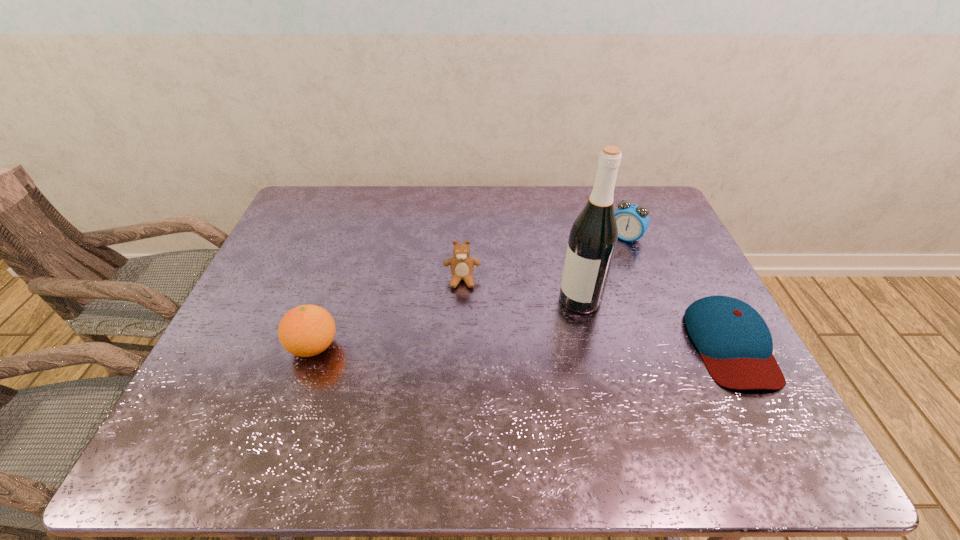
At what (x,y) coordinates should I click in order to perform the action: click on vacant area located on the face of the alarm clock. Please return your answer as a coordinate pair (x, y). This screenshot has width=960, height=540. Looking at the image, I should click on (559, 326).

This screenshot has height=540, width=960. I want to click on vacant area situated 0.140m on the face of the alarm clock, so click(600, 270).

Find the location of `vacant space located 0.080m on the label of the wine bottle`. vacant space located 0.080m on the label of the wine bottle is located at coordinates (550, 328).

Where is `blank space located 0.170m on the label of the wine bottle`? This screenshot has height=540, width=960. blank space located 0.170m on the label of the wine bottle is located at coordinates (528, 349).

At what (x,y) coordinates should I click in order to perform the action: click on vacant space located 0.140m on the label of the wine bottle. Please return your answer as a coordinate pair (x, y). The width and height of the screenshot is (960, 540). Looking at the image, I should click on (536, 342).

Locate an element on the screen. The image size is (960, 540). free location located 0.060m on the front-facing side of the teddy bear is located at coordinates (462, 306).

The height and width of the screenshot is (540, 960). In order to click on vacant point located on the front-facing side of the teddy bear in this screenshot , I will do `click(461, 338)`.

I want to click on vacant region located 0.250m on the front-facing side of the teddy bear, so click(461, 364).

Locate an element on the screen. The height and width of the screenshot is (540, 960). object that is at the near edge is located at coordinates (735, 343).

The width and height of the screenshot is (960, 540). I want to click on baseball cap positioned at the right edge, so click(x=735, y=343).